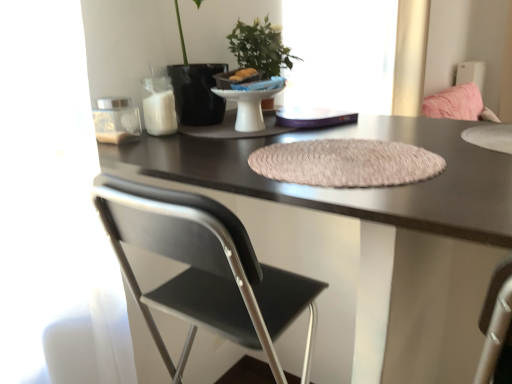
Question: Can you confirm if matte black desk at center is smaller than black matte chair at center?

Choices:
 (A) yes
 (B) no

Answer: (B)

Question: Is matte black desk at center facing towards black matte chair at center?

Choices:
 (A) yes
 (B) no

Answer: (A)

Question: Is matte black desk at center far from black matte chair at center?

Choices:
 (A) yes
 (B) no

Answer: (B)

Question: Considering the relative sizes of matte black desk at center and black matte chair at center in the image provided, is matte black desk at center taller than black matte chair at center?

Choices:
 (A) yes
 (B) no

Answer: (A)

Question: Does matte black desk at center appear on the right side of black matte chair at center?

Choices:
 (A) no
 (B) yes

Answer: (B)

Question: Considering the relative sizes of matte black desk at center and black matte chair at center in the image provided, is matte black desk at center shorter than black matte chair at center?

Choices:
 (A) no
 (B) yes

Answer: (A)

Question: From a real-world perspective, is matte black desk at center located beneath transparent glass window at upper center?

Choices:
 (A) no
 (B) yes

Answer: (B)

Question: Does matte black desk at center lie in front of transparent glass window at upper center?

Choices:
 (A) no
 (B) yes

Answer: (B)

Question: Would you say transparent glass window at upper center is part of matte black desk at center's contents?

Choices:
 (A) yes
 (B) no

Answer: (B)

Question: Is matte black desk at center not close to transparent glass window at upper center?

Choices:
 (A) no
 (B) yes

Answer: (A)

Question: Is matte black desk at center directly adjacent to transparent glass window at upper center?

Choices:
 (A) yes
 (B) no

Answer: (B)

Question: Does matte black desk at center have a lesser height compared to transparent glass window at upper center?

Choices:
 (A) no
 (B) yes

Answer: (A)

Question: Can you confirm if transparent glass window at upper center is taller than beige textured placemat at center?

Choices:
 (A) yes
 (B) no

Answer: (A)